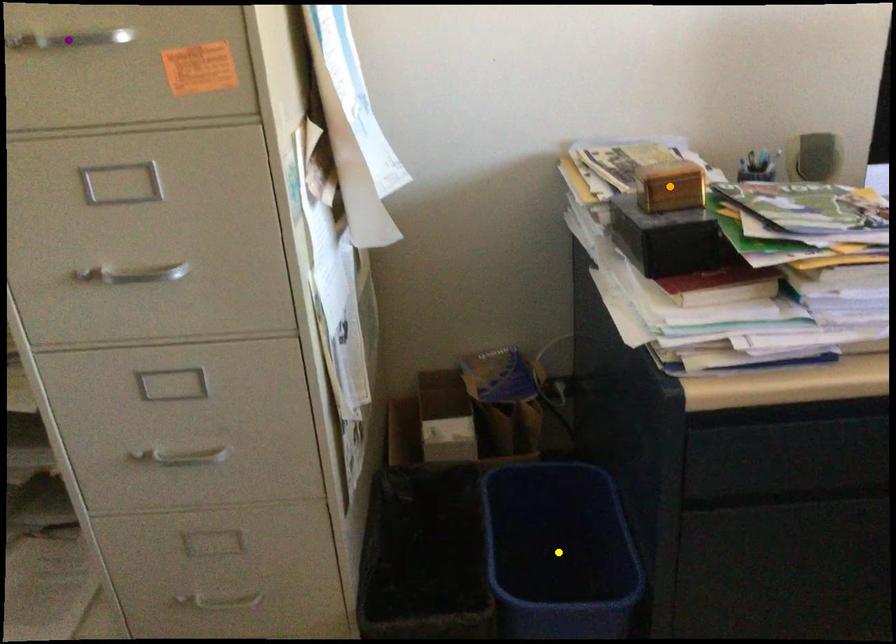
Order these from nearest to farthest:
1. orange point
2. purple point
3. yellow point

purple point, orange point, yellow point